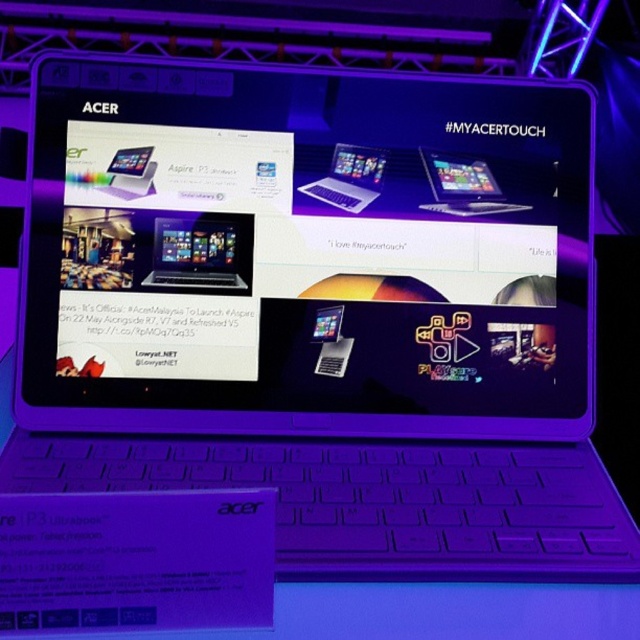
Which is more to the right, matte black laptop at center or silver metallic laptop at center?

Positioned to the right is silver metallic laptop at center.

Can you confirm if matte black laptop at center is positioned to the left of silver metallic laptop at center?

Yes, matte black laptop at center is to the left of silver metallic laptop at center.

This screenshot has height=640, width=640. What are the coordinates of `matte black laptop at center` in the screenshot? It's located at (202, 253).

Does matte black laptop at center appear on the right side of sleek silver laptop at center?

In fact, matte black laptop at center is to the left of sleek silver laptop at center.

Who is positioned more to the left, matte black laptop at center or sleek silver laptop at center?

matte black laptop at center

At what (x,y) coordinates should I click in order to perform the action: click on matte black laptop at center. Please return your answer as a coordinate pair (x, y). Image resolution: width=640 pixels, height=640 pixels. Looking at the image, I should click on (202, 253).

Is silver metallic laptop at center to the right of sleek silver laptop at center from the viewer's perspective?

Indeed, silver metallic laptop at center is positioned on the right side of sleek silver laptop at center.

Is point (433, 177) closer to camera compared to point (355, 193)?

That is False.

Which is in front, point (435, 168) or point (337, 198)?

Point (337, 198) is in front.

Identify the location of silver metallic laptop at center. The image size is (640, 640). pos(464,186).